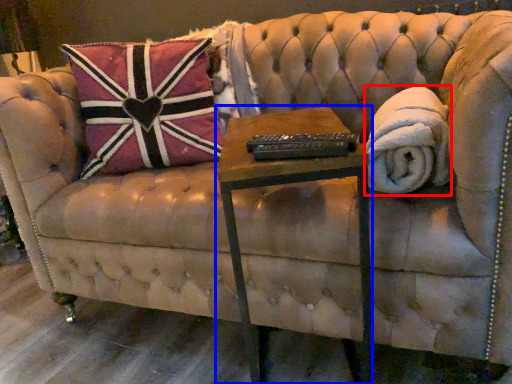
Question: Among these objects, which one is farthest to the camera, blanket (highlighted by a red box) or table (highlighted by a blue box)?

Choices:
 (A) blanket
 (B) table

Answer: (A)